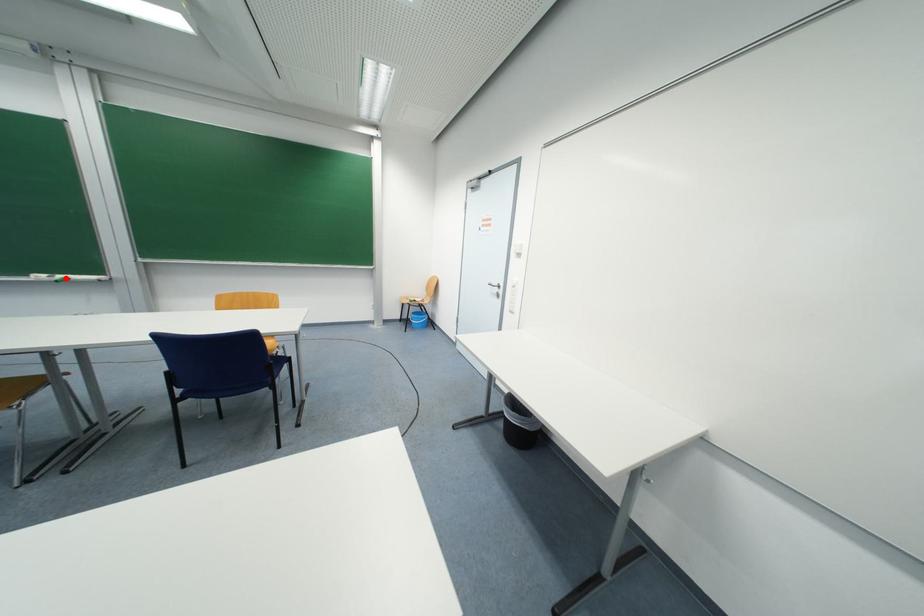
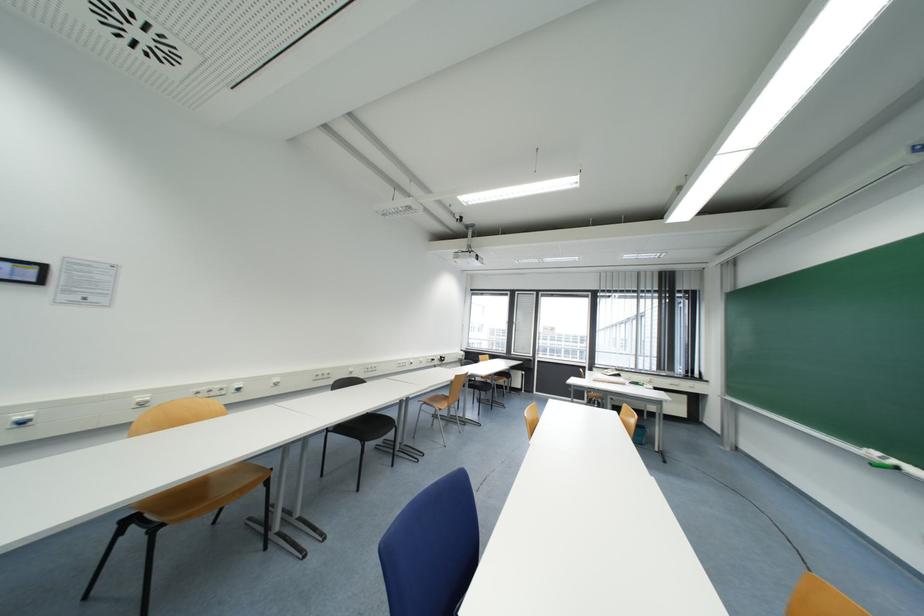
Where in the second image is the point corresponding to the highlighted location from the first image?

(898, 464)